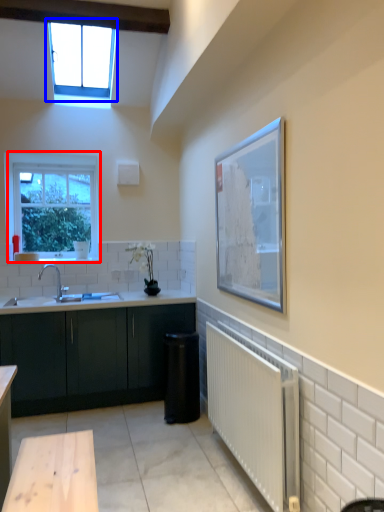
Question: Which point is closer to the camera, window (highlighted by a red box) or window (highlighted by a blue box)?

Choices:
 (A) window
 (B) window

Answer: (B)